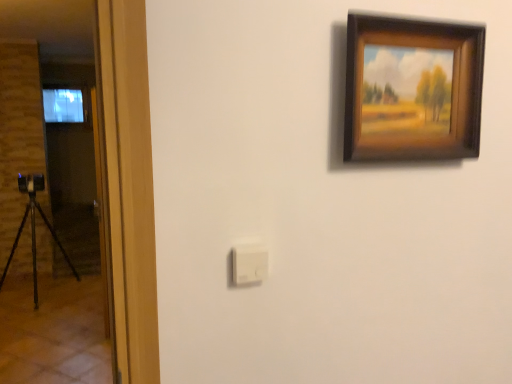
Question: Is the position of white plastic light switch at center less distant than that of wooden frame at upper right?

Choices:
 (A) yes
 (B) no

Answer: (B)

Question: Could you tell me if white plastic light switch at center is facing wooden frame at upper right?

Choices:
 (A) no
 (B) yes

Answer: (A)

Question: From the image's perspective, would you say white plastic light switch at center is positioned over wooden frame at upper right?

Choices:
 (A) yes
 (B) no

Answer: (B)

Question: Is white plastic light switch at center turned away from wooden frame at upper right?

Choices:
 (A) yes
 (B) no

Answer: (B)

Question: Considering the relative sizes of white plastic light switch at center and wooden frame at upper right in the image provided, is white plastic light switch at center smaller than wooden frame at upper right?

Choices:
 (A) yes
 (B) no

Answer: (A)

Question: Considering the relative sizes of white plastic light switch at center and wooden frame at upper right in the image provided, is white plastic light switch at center shorter than wooden frame at upper right?

Choices:
 (A) no
 (B) yes

Answer: (B)

Question: Can you confirm if wooden frame at upper right is shorter than white plastic light switch at center?

Choices:
 (A) yes
 (B) no

Answer: (B)

Question: Can you confirm if wooden frame at upper right is taller than white plastic light switch at center?

Choices:
 (A) no
 (B) yes

Answer: (B)

Question: Is wooden frame at upper right looking in the opposite direction of white plastic light switch at center?

Choices:
 (A) yes
 (B) no

Answer: (B)

Question: Are wooden frame at upper right and white plastic light switch at center making contact?

Choices:
 (A) yes
 (B) no

Answer: (B)

Question: From the image's perspective, is wooden frame at upper right below white plastic light switch at center?

Choices:
 (A) no
 (B) yes

Answer: (A)

Question: Considering the relative positions of wooden frame at upper right and white plastic light switch at center in the image provided, is wooden frame at upper right behind white plastic light switch at center?

Choices:
 (A) no
 (B) yes

Answer: (A)

Question: Is white plastic light switch at center situated inside wooden frame at upper right or outside?

Choices:
 (A) inside
 (B) outside

Answer: (B)